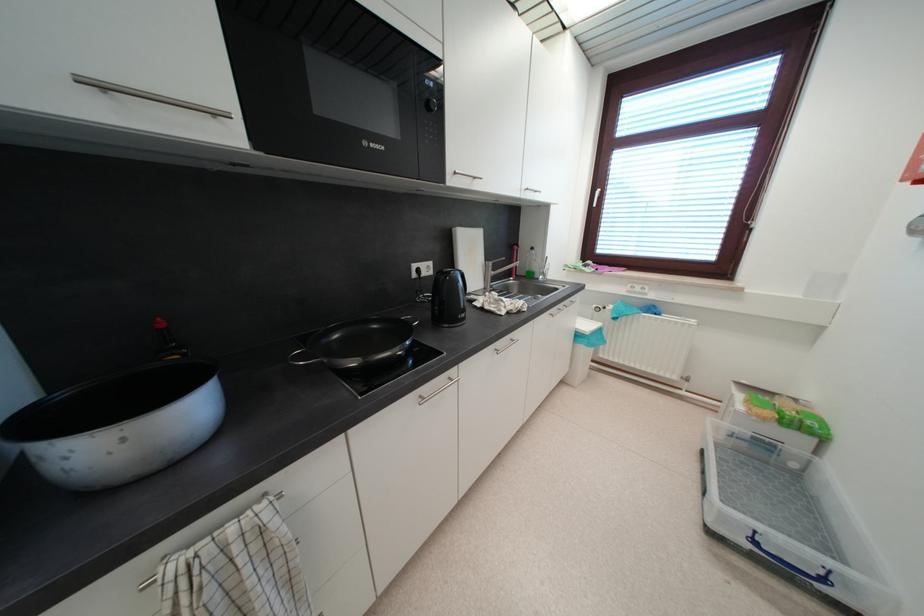
Locate an element on the screen. blind pull cord is located at coordinates (751, 201).